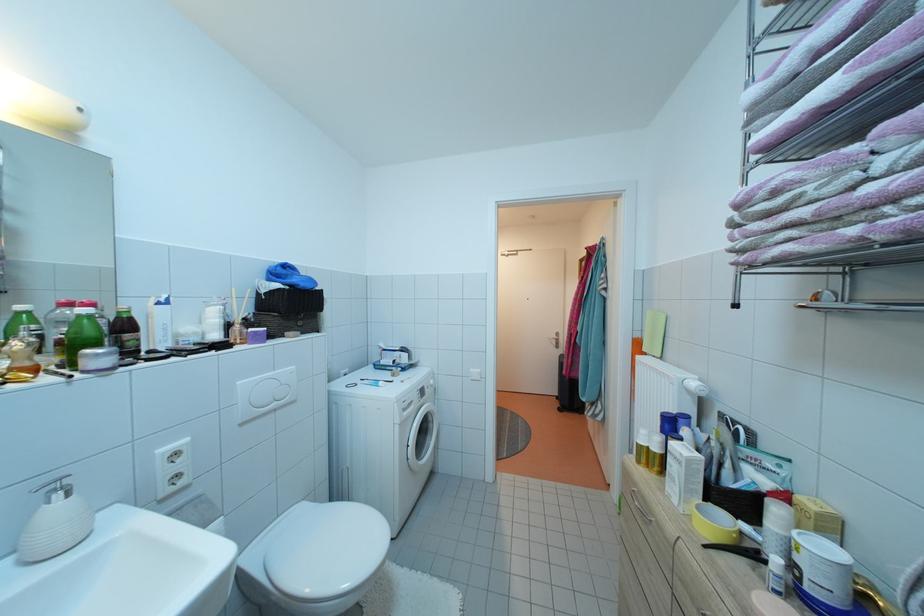
Find where to pull the detergent drawer handle. Please return your answer as a coordinate pair (x, y).

(638, 506)